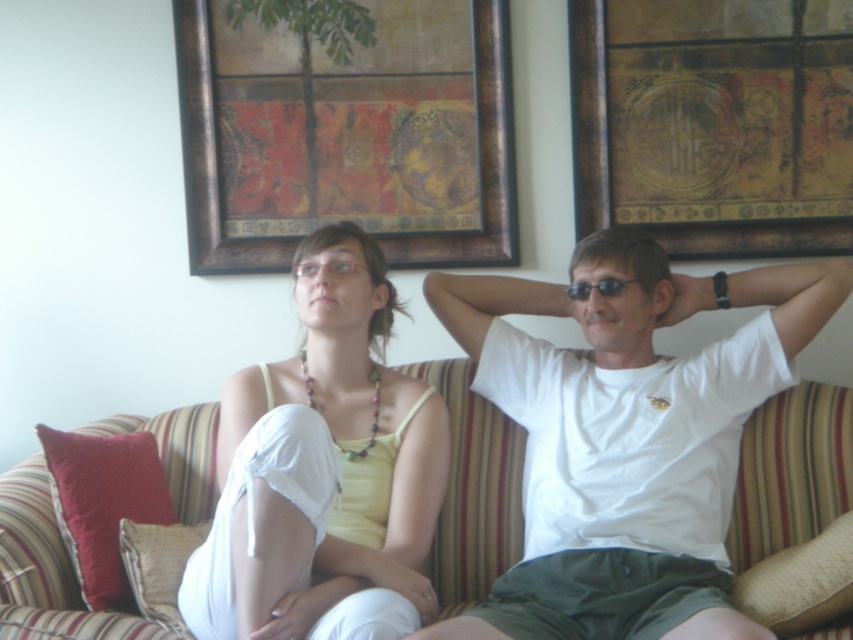
You are a painter standing 2 feet away from the wooden picture frame at upper center. You want to move to the beige fabric pillow at lower right without moving any objects. Can you reach the pillow from your current position?

The distance between wooden picture frame at upper center and beige fabric pillow at lower right is 3.60 feet. Since you are already 2 feet away from the wooden picture frame at upper center, you need to cover an additional 1.60 feet to reach the beige fabric pillow at lower right. Therefore, you can move to the beige fabric pillow at lower right without moving any objects.

You are a guest in this living room and want to place a small vase on the beige fabric pillow at lower right. However, you need to ensure it won not block the view of the wooden picture frame at upper center. Is the location suitable?

The wooden picture frame at upper center is located above the beige fabric pillow at lower right, so placing the vase on the pillow won block the view of the wooden picture frame at upper center since it is positioned above.